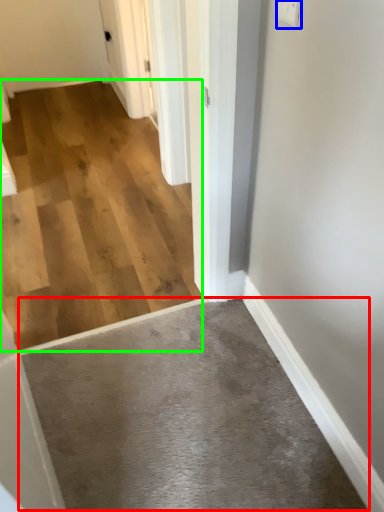
Question: Based on their relative distances, which object is farther from concrete (highlighted by a red box)? Choose from electric outlet (highlighted by a blue box) and concrete (highlighted by a green box).

Choices:
 (A) electric outlet
 (B) concrete

Answer: (A)